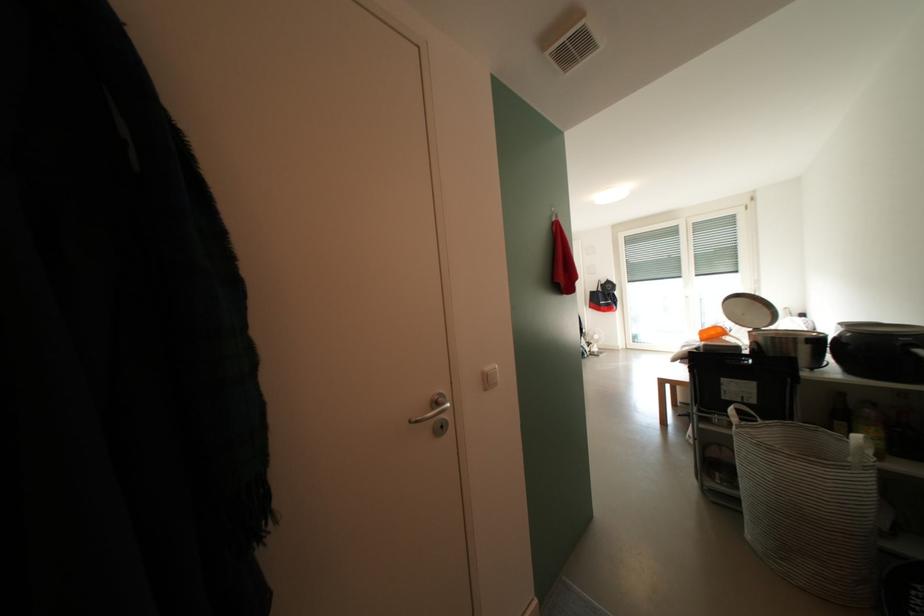
The width and height of the screenshot is (924, 616). What are the coordinates of `silver cooker lid` in the screenshot? It's located at (748, 310).